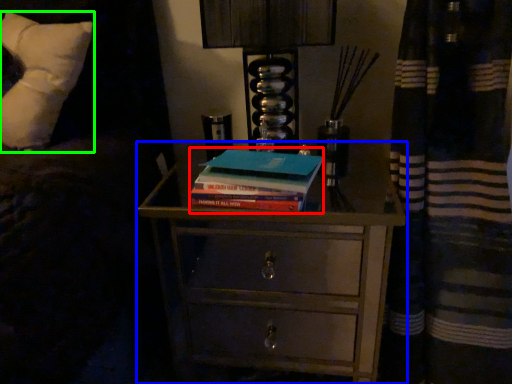
Question: Which is farther away from paperback book (highlighted by a red box)? chest of drawers (highlighted by a blue box) or pillow (highlighted by a green box)?

Choices:
 (A) chest of drawers
 (B) pillow

Answer: (A)